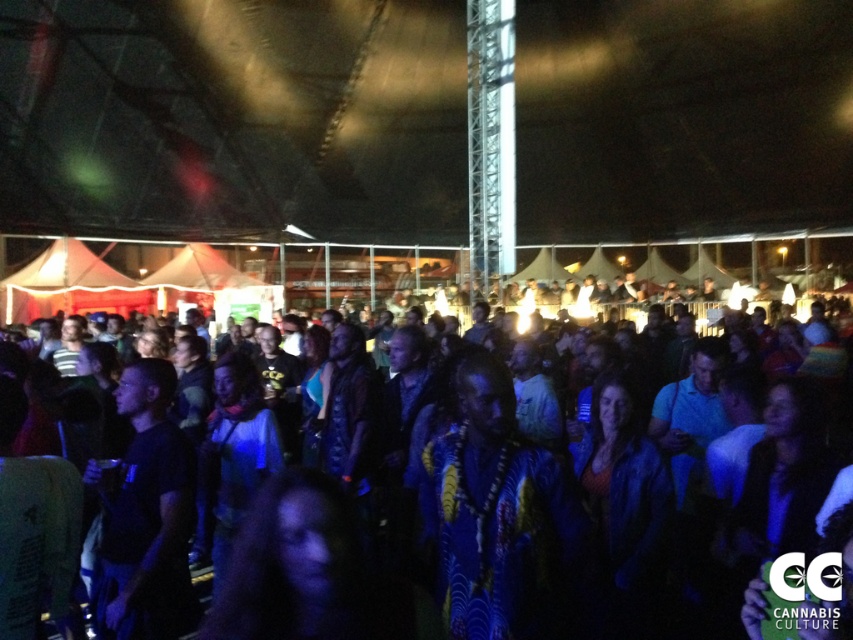
Question: Which point is farther to the camera?

Choices:
 (A) (567, 632)
 (B) (141, 388)
 (C) (708, 493)

Answer: (C)

Question: Among these objects, which one is farthest from the camera?

Choices:
 (A) dark blue t-shirt at center
 (B) printed fabric shirt at center

Answer: (A)

Question: Observing the image, what is the correct spatial positioning of dark blue fabric crowd at center in reference to printed fabric shirt at center?

Choices:
 (A) right
 (B) left

Answer: (A)

Question: Does dark blue fabric crowd at center appear under printed fabric shirt at center?

Choices:
 (A) yes
 (B) no

Answer: (A)

Question: Does dark blue fabric crowd at center have a smaller size compared to dark blue t-shirt at center?

Choices:
 (A) yes
 (B) no

Answer: (A)

Question: Among these objects, which one is nearest to the camera?

Choices:
 (A) dark blue fabric crowd at center
 (B) printed fabric shirt at center

Answer: (B)